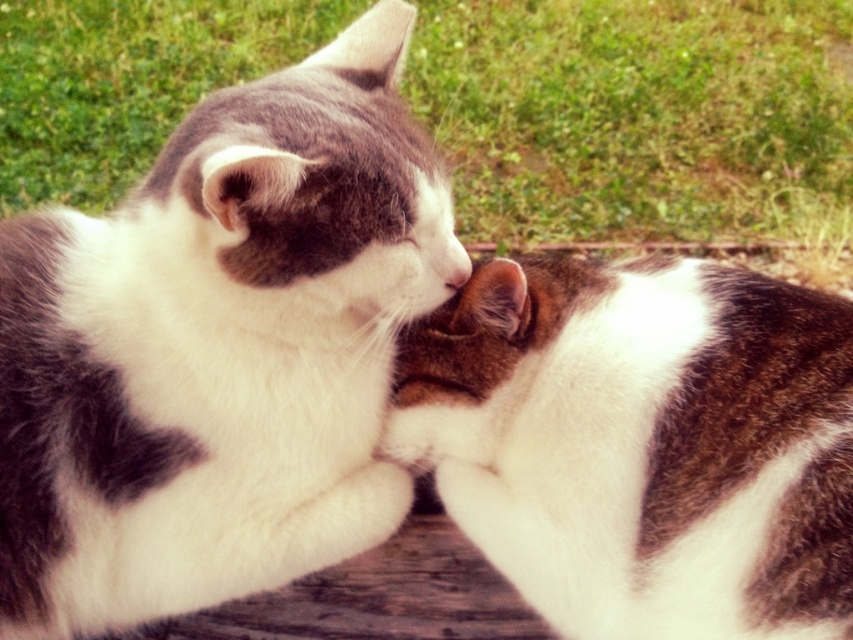
What do you see at coordinates (642, 444) in the screenshot?
I see `white fur cat at center` at bounding box center [642, 444].

Measure the distance between white fur cat at center and camera.

The distance of white fur cat at center from camera is 3.35 feet.

Locate an element on the screen. Image resolution: width=853 pixels, height=640 pixels. white fur cat at center is located at coordinates (642, 444).

Which of these two, white-furred cat at center or matte white nose at center, stands shorter?

matte white nose at center is shorter.

Is point (51, 356) farther from camera compared to point (463, 252)?

No, it is not.

Where is `white-furred cat at center`? The width and height of the screenshot is (853, 640). white-furred cat at center is located at coordinates (218, 349).

Who is higher up, white-furred cat at center or white fur cat at center?

white-furred cat at center is higher up.

Does point (367, 48) lie behind point (462, 378)?

Yes, point (367, 48) is farther from viewer.

This screenshot has height=640, width=853. I want to click on white-furred cat at center, so click(218, 349).